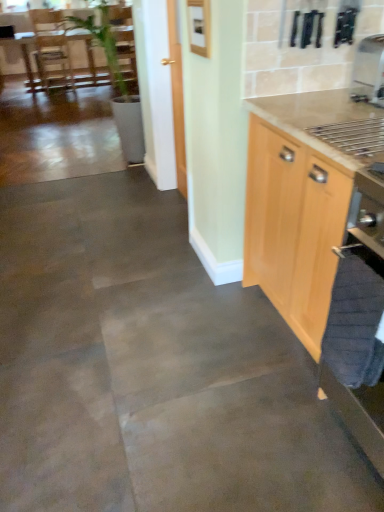
The height and width of the screenshot is (512, 384). Describe the element at coordinates (369, 71) in the screenshot. I see `satin silver coffee machine at upper right` at that location.

What is the approximate width of satin silver coffee machine at upper right?

The width of satin silver coffee machine at upper right is 25.57 centimeters.

At what (x,y) coordinates should I click in order to perform the action: click on brown wooden table at upper left. Please return your answer as a coordinate pair (x, y). This screenshot has height=512, width=384. Looking at the image, I should click on (88, 61).

I want to click on satin silver coffee machine at upper right, so click(369, 71).

Considering the relative sizes of satin silver coffee machine at upper right and brown wooden table at upper left in the image provided, is satin silver coffee machine at upper right wider than brown wooden table at upper left?

No, satin silver coffee machine at upper right is not wider than brown wooden table at upper left.

Identify the location of table behind the satin silver coffee machine at upper right. The image size is (384, 512). (88, 61).

Is satin silver coffee machine at upper right positioned with its back to brown wooden table at upper left?

No.

Based on the photo, considering the sizes of objects satin silver coffee machine at upper right and brown wooden table at upper left in the image provided, who is bigger, satin silver coffee machine at upper right or brown wooden table at upper left?

Bigger between the two is brown wooden table at upper left.

Can you confirm if satin silver coffee machine at upper right is bigger than light wood cabinet at right?

No.

Is light wood cabinet at right at the back of satin silver coffee machine at upper right?

No, satin silver coffee machine at upper right is not facing away from light wood cabinet at right.

Would you say satin silver coffee machine at upper right is to the left or to the right of light wood cabinet at right in the picture?

In the image, satin silver coffee machine at upper right appears on the right side of light wood cabinet at right.

Based on the photo, from a real-world perspective, is satin silver coffee machine at upper right physically below light wood cabinet at right?

No.

Considering the sizes of objects light wood cabinet at right and brown wooden table at upper left in the image provided, who is smaller, light wood cabinet at right or brown wooden table at upper left?

light wood cabinet at right.

What are the coordinates of `table behind the light wood cabinet at right` in the screenshot? It's located at (88, 61).

Can you confirm if light wood cabinet at right is wider than brown wooden table at upper left?

No.

Considering the positions of objects brown wooden table at upper left and satin silver coffee machine at upper right in the image provided, who is in front, brown wooden table at upper left or satin silver coffee machine at upper right?

satin silver coffee machine at upper right.

Looking at this image, are brown wooden table at upper left and satin silver coffee machine at upper right beside each other?

There is a gap between brown wooden table at upper left and satin silver coffee machine at upper right.

Is satin silver coffee machine at upper right at the back of brown wooden table at upper left?

brown wooden table at upper left does not have its back to satin silver coffee machine at upper right.

Which is farther from the camera, (106, 82) or (284, 281)?

Positioned behind is point (106, 82).

From a real-world perspective, is brown wooden table at upper left physically above light wood cabinet at right?

Actually, brown wooden table at upper left is physically below light wood cabinet at right in the real world.

Consider the image. What's the angular difference between brown wooden table at upper left and light wood cabinet at right's facing directions?

They differ by 90.9 degrees in their facing directions.

Considering the relative sizes of brown wooden table at upper left and light wood cabinet at right in the image provided, is brown wooden table at upper left thinner than light wood cabinet at right?

In fact, brown wooden table at upper left might be wider than light wood cabinet at right.

From a real-world perspective, which is physically below, light wood cabinet at right or satin silver coffee machine at upper right?

light wood cabinet at right, from a real-world perspective.

Is light wood cabinet at right wider than satin silver coffee machine at upper right?

Yes.

Between light wood cabinet at right and satin silver coffee machine at upper right, which one has larger size?

light wood cabinet at right.

Does light wood cabinet at right touch satin silver coffee machine at upper right?

light wood cabinet at right and satin silver coffee machine at upper right are not in contact.

This screenshot has height=512, width=384. I want to click on table that is behind the satin silver coffee machine at upper right, so click(88, 61).

You are a GUI agent. You are given a task and a screenshot of the screen. Output one action in this format:
    pyautogui.click(x=<x>, y=<y>)
    Task: Click on the cabinetry beneath the satin silver coffee machine at upper right (from a real-world perspective)
    
    Given the screenshot: What is the action you would take?
    pyautogui.click(x=293, y=227)

Which object lies further to the anchor point light wood cabinet at right, brown wooden table at upper left or satin silver coffee machine at upper right?

Among the two, brown wooden table at upper left is located further to light wood cabinet at right.

Based on their spatial positions, is satin silver coffee machine at upper right or brown wooden table at upper left further from light wood cabinet at right?

The object further to light wood cabinet at right is brown wooden table at upper left.

Which object lies nearer to the anchor point brown wooden table at upper left, light wood cabinet at right or satin silver coffee machine at upper right?

Based on the image, satin silver coffee machine at upper right appears to be nearer to brown wooden table at upper left.

Based on their spatial positions, is satin silver coffee machine at upper right or light wood cabinet at right closer to brown wooden table at upper left?

Based on the image, satin silver coffee machine at upper right appears to be nearer to brown wooden table at upper left.

Based on their spatial positions, is brown wooden table at upper left or light wood cabinet at right further from satin silver coffee machine at upper right?

Based on the image, brown wooden table at upper left appears to be further to satin silver coffee machine at upper right.

Which object lies further to the anchor point satin silver coffee machine at upper right, light wood cabinet at right or brown wooden table at upper left?

Based on the image, brown wooden table at upper left appears to be further to satin silver coffee machine at upper right.

This screenshot has height=512, width=384. What are the coordinates of `coffee machine located between light wood cabinet at right and brown wooden table at upper left in the depth direction` in the screenshot? It's located at (369, 71).